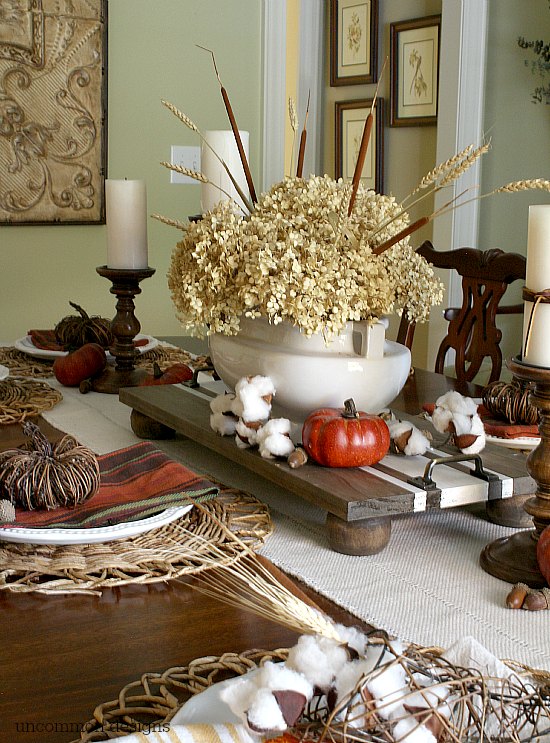
Locate an element on the screen. The height and width of the screenshot is (743, 550). white candle is located at coordinates (133, 233).